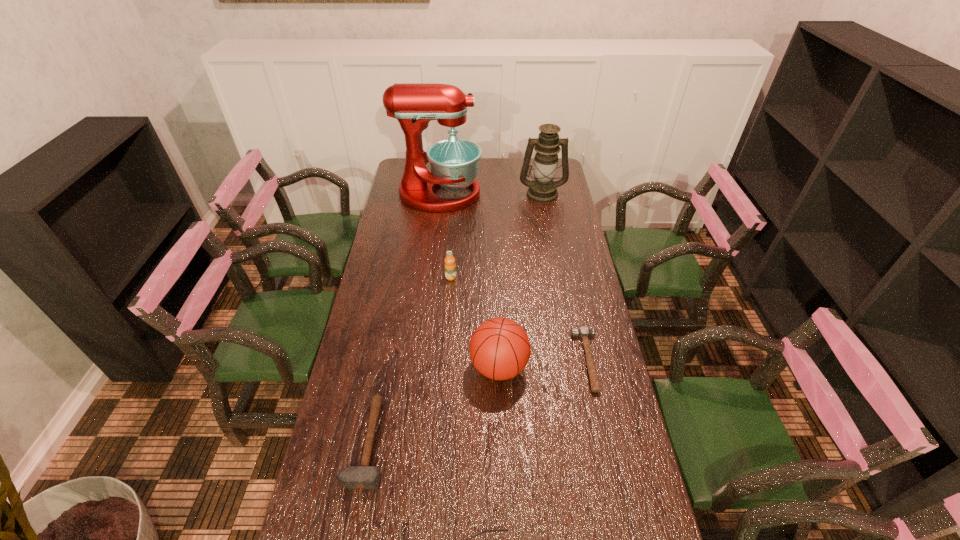
Identify the location of mixer. The width and height of the screenshot is (960, 540). click(x=454, y=162).

The width and height of the screenshot is (960, 540). Identify the location of the second tallest object. (542, 189).

The width and height of the screenshot is (960, 540). I want to click on basketball, so click(x=499, y=348).

The image size is (960, 540). I want to click on the third farthest object, so click(450, 267).

Where is `orange juice`? Image resolution: width=960 pixels, height=540 pixels. orange juice is located at coordinates (450, 267).

Image resolution: width=960 pixels, height=540 pixels. Find the location of `the fifth tallest object`. the fifth tallest object is located at coordinates (364, 476).

Locate an element on the screen. the taller hammer is located at coordinates (364, 476).

Locate an element on the screen. the right hammer is located at coordinates [x=583, y=332].

Locate an element on the screen. The image size is (960, 540). the shorter hammer is located at coordinates (583, 332).

In order to click on vacant region located on the front-facing side of the mixer in this screenshot , I will do `click(494, 194)`.